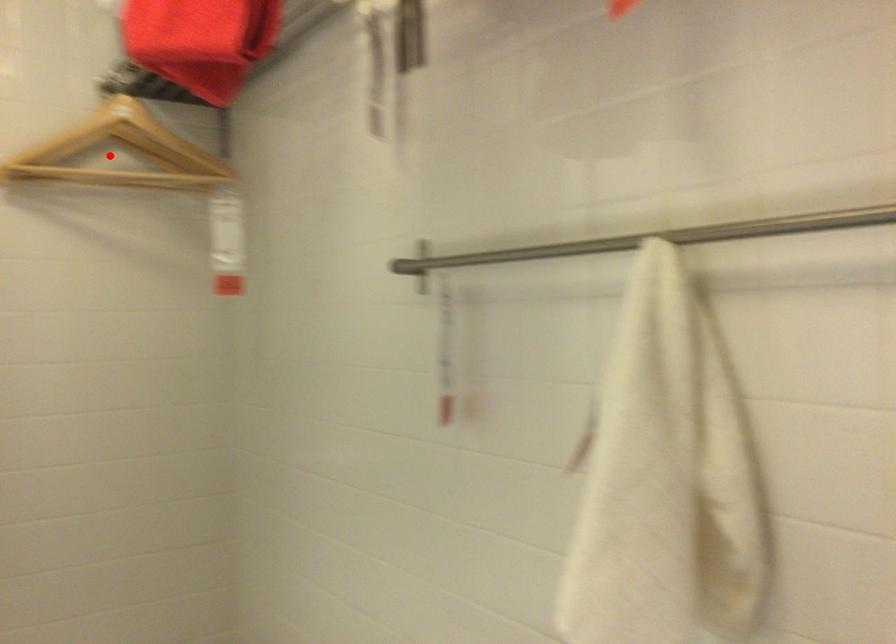
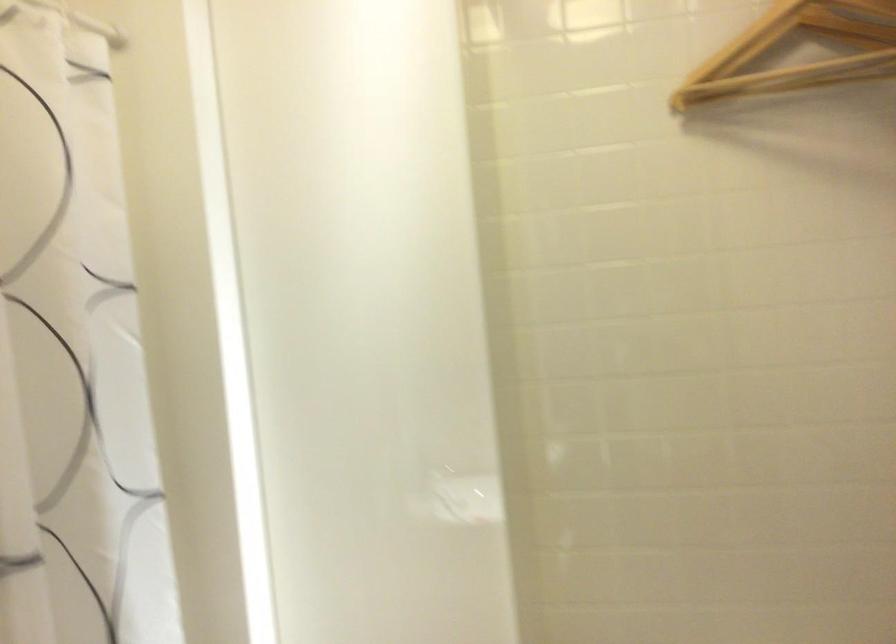
The point at the highlighted location is marked in the first image. Where is the corresponding point in the second image?

(797, 51)